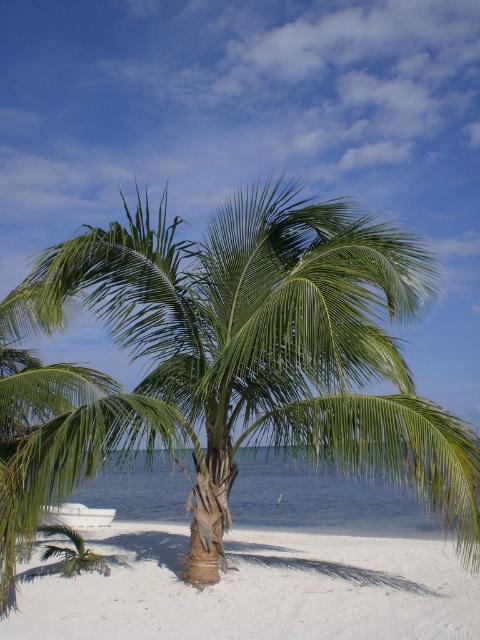
Question: Is green leafy palm tree at center closer to camera compared to white sandy beach at center?

Choices:
 (A) yes
 (B) no

Answer: (A)

Question: Can you confirm if green leafy palm tree at center is positioned below white sandy beach at center?

Choices:
 (A) yes
 (B) no

Answer: (B)

Question: Can you confirm if green leafy palm tree at center is positioned to the left of white sandy beach at center?

Choices:
 (A) yes
 (B) no

Answer: (B)

Question: Among these objects, which one is farthest from the camera?

Choices:
 (A) white sandy beach at center
 (B) green leafy palm tree at center

Answer: (A)